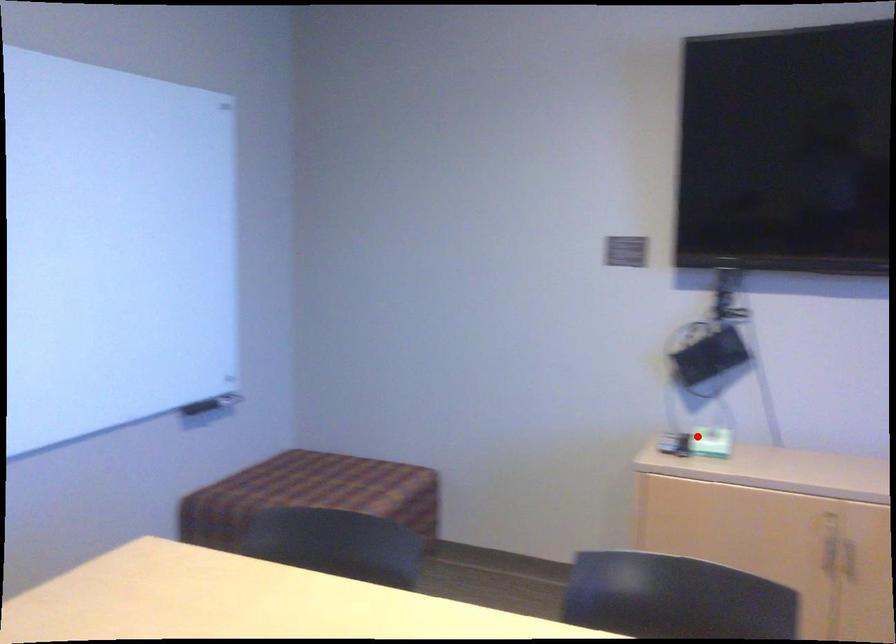
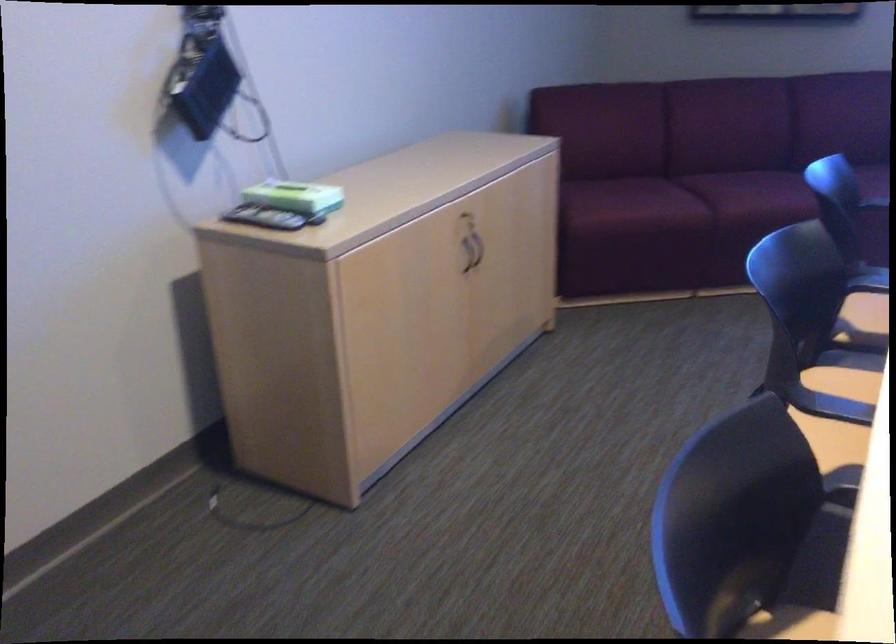
Locate, in the second image, the point that corresponds to the highlighted location in the first image.

(287, 196)